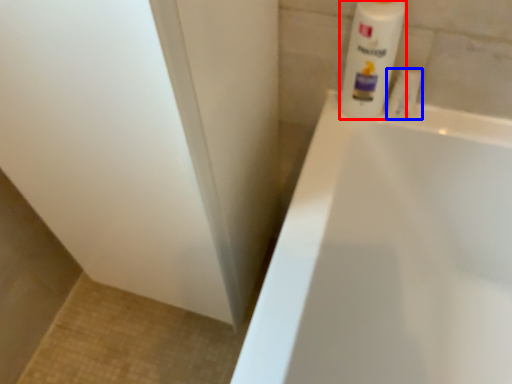
Question: Which object appears closest to the camera in this image, cleaning product (highlighted by a red box) or toiletry (highlighted by a blue box)?

Choices:
 (A) cleaning product
 (B) toiletry

Answer: (A)